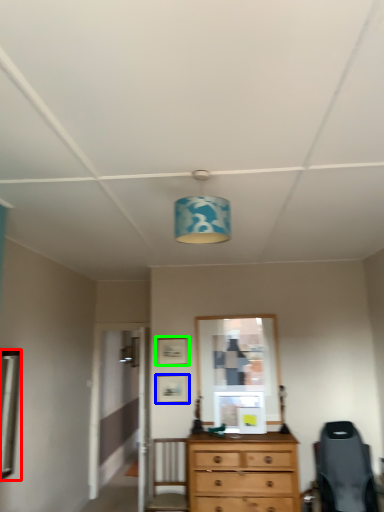
Question: Which object is positioned closest to mirror (highlighted by a red box)? Select from picture frame (highlighted by a blue box) and picture frame (highlighted by a green box).

Choices:
 (A) picture frame
 (B) picture frame

Answer: (A)